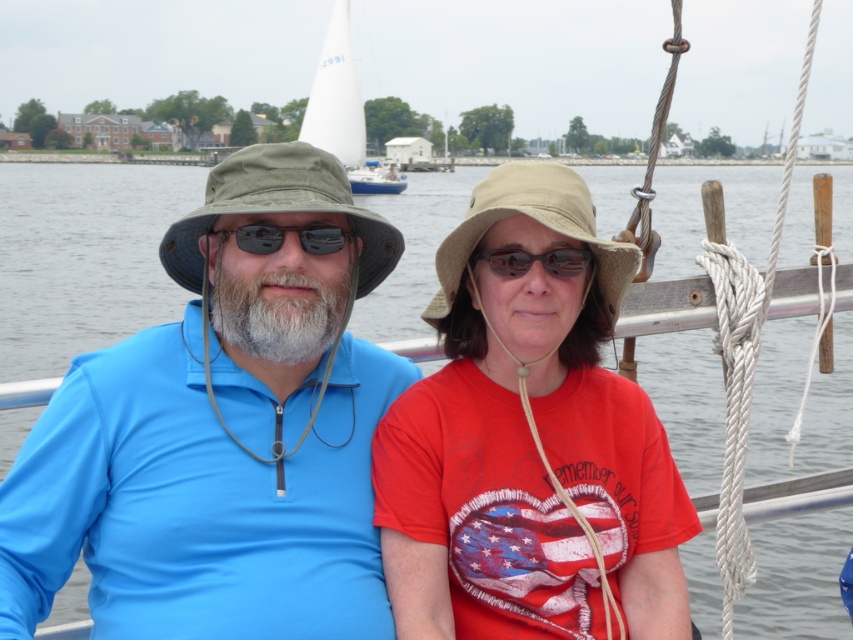
Question: Is tan fabric hat at center positioned in front of white sailboat at upper center?

Choices:
 (A) yes
 (B) no

Answer: (A)

Question: Is green camo hat at left in front of tan fabric hat at center?

Choices:
 (A) no
 (B) yes

Answer: (A)

Question: Considering the real-world distances, which object is closest to the tan fabric hat at center?

Choices:
 (A) black plastic goggles at center
 (B) white glossy boat at upper center

Answer: (A)

Question: Based on their relative distances, which object is farther from the matte black goggles at center?

Choices:
 (A) white glossy boat at upper center
 (B) matte blue shirt at center

Answer: (A)

Question: Which is nearer to the white glossy boat at upper center?

Choices:
 (A) matte khaki bucket hat at center
 (B) green camo hat at left
 (C) matte black goggles at center

Answer: (B)

Question: Considering the relative positions of tan fabric hat at center and matte black goggles at center in the image provided, where is tan fabric hat at center located with respect to matte black goggles at center?

Choices:
 (A) above
 (B) below

Answer: (A)